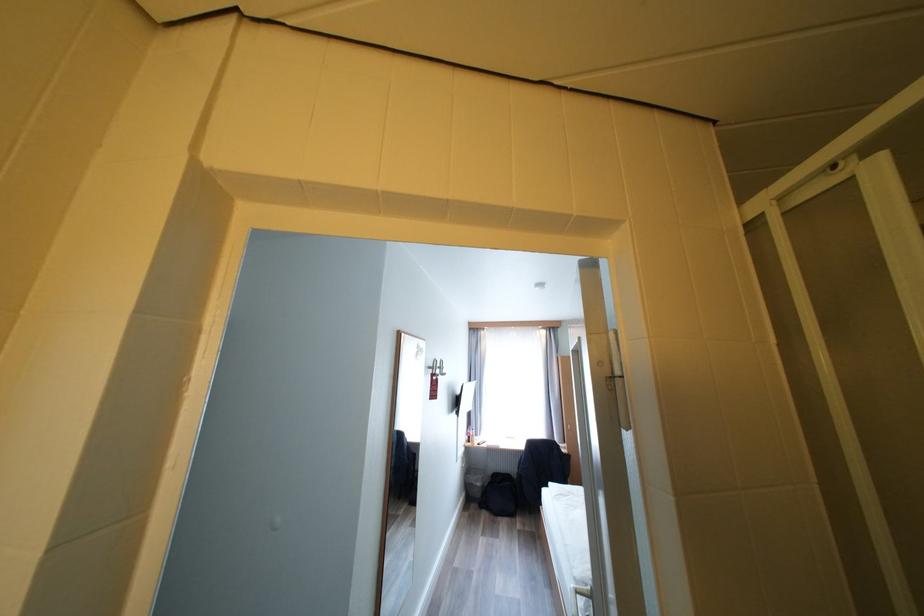
You are a GUI agent. You are given a task and a screenshot of the screen. Output one action in this format:
    pyautogui.click(x=<x>, y=<y>)
    Task: Click on the white wall button
    This screenshot has width=924, height=616.
    Given the screenshot: What is the action you would take?
    pyautogui.click(x=274, y=522)